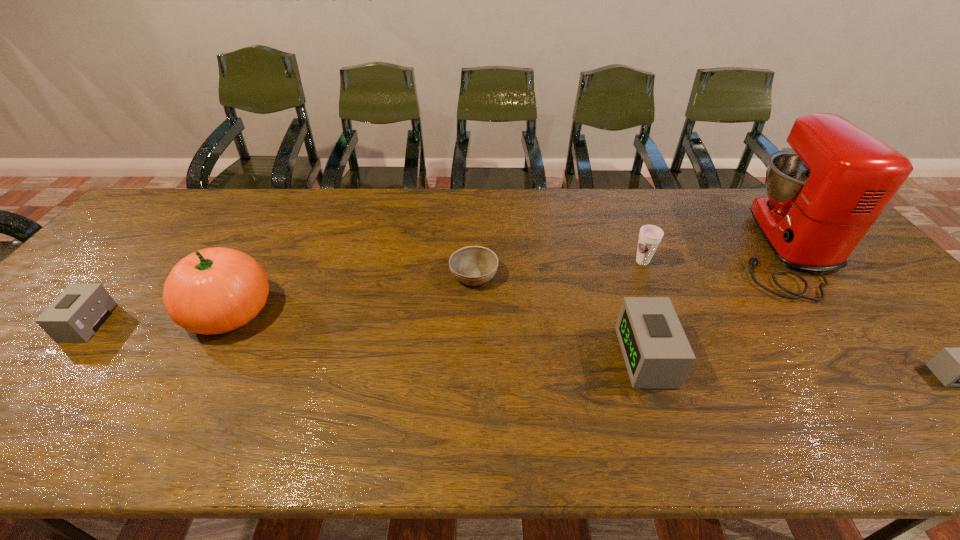
This screenshot has height=540, width=960. What are the coordinates of `the leftmost alarm clock` in the screenshot? It's located at (81, 309).

Find the location of a particular element. the second tallest alarm clock is located at coordinates (81, 309).

I want to click on the second alarm clock from right to left, so click(x=656, y=351).

In order to click on the tallest object in this screenshot , I will do `click(823, 195)`.

This screenshot has width=960, height=540. I want to click on the second object from left to right, so click(215, 290).

Locate an element on the screen. pumpkin is located at coordinates (215, 290).

This screenshot has width=960, height=540. I want to click on cup, so click(650, 236).

The height and width of the screenshot is (540, 960). Find the location of `the shortest object`. the shortest object is located at coordinates (472, 265).

Locate an element on the screen. the third object from left to right is located at coordinates (472, 265).

The height and width of the screenshot is (540, 960). In order to click on vacant space located on the front-facing side of the second shortest alarm clock in this screenshot , I will do `click(37, 323)`.